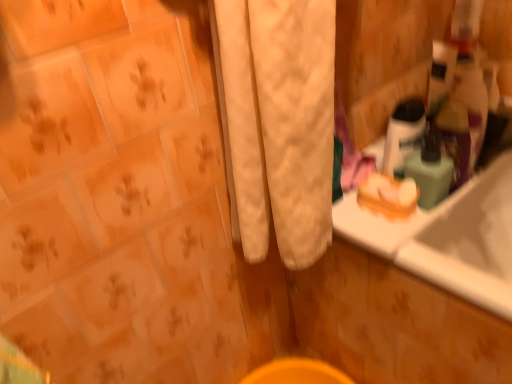
Measure the distance between point (400, 203) and camera.

Point (400, 203) is 79.60 centimeters away from camera.

At what (x,y) coordinates should I click in order to perform the action: click on orange matte soap at right. Please return your answer as a coordinate pair (x, y). Looking at the image, I should click on (388, 195).

The image size is (512, 384). What do you see at coordinates (430, 171) in the screenshot?
I see `green matte bottle at upper right, marked as the first mouthwash in a right-to-left arrangement` at bounding box center [430, 171].

Find the location of a particular element. The width and height of the screenshot is (512, 384). orange matte soap at right is located at coordinates (388, 195).

Is orange matte soap at right at the left side of translucent plastic mouthwash at upper right, arranged as the second mouthwash when viewed from the right?

Correct, you'll find orange matte soap at right to the left of translucent plastic mouthwash at upper right, arranged as the second mouthwash when viewed from the right.

Looking at this image, from the image's perspective, relative to translucent plastic mouthwash at upper right, the 1th mouthwash from the left, is orange matte soap at right above or below?

Clearly, from the image's perspective, orange matte soap at right is below translucent plastic mouthwash at upper right, the 1th mouthwash from the left.

Which of these two, orange matte soap at right or translucent plastic mouthwash at upper right, the 1th mouthwash from the left, is smaller?

With smaller size is orange matte soap at right.

From their relative heights in the image, would you say orange matte soap at right is taller or shorter than translucent plastic mouthwash at upper right, the 1th mouthwash from the left?

In the image, orange matte soap at right appears to be shorter than translucent plastic mouthwash at upper right, the 1th mouthwash from the left.

Relative to orange matte soap at right, is translucent plastic mouthwash at upper right, arranged as the second mouthwash when viewed from the right, in front or behind?

translucent plastic mouthwash at upper right, arranged as the second mouthwash when viewed from the right, is in front of orange matte soap at right.

Based on the photo, who is shorter, translucent plastic mouthwash at upper right, arranged as the second mouthwash when viewed from the right, or orange matte soap at right?

Standing shorter between the two is orange matte soap at right.

From the image's perspective, does translucent plastic mouthwash at upper right, arranged as the second mouthwash when viewed from the right, appear higher than orange matte soap at right?

Yes, from the image's perspective, translucent plastic mouthwash at upper right, arranged as the second mouthwash when viewed from the right, is above orange matte soap at right.

Between point (385, 153) and point (408, 214), which one is positioned behind?

The point (385, 153) is behind.

Which object is positioned more to the left, green matte bottle at upper right, the 2th mouthwash in the left-to-right sequence, or orange matte soap at right?

From the viewer's perspective, orange matte soap at right appears more on the left side.

Between green matte bottle at upper right, the 2th mouthwash in the left-to-right sequence, and orange matte soap at right, which one has larger width?

Wider between the two is orange matte soap at right.

Is green matte bottle at upper right, marked as the first mouthwash in a right-to-left arrangement, in contact with orange matte soap at right?

Yes, green matte bottle at upper right, marked as the first mouthwash in a right-to-left arrangement, is next to orange matte soap at right.

This screenshot has width=512, height=384. What are the coordinates of `soap beneath the green matte bottle at upper right, the 2th mouthwash in the left-to-right sequence (from a real-world perspective)` in the screenshot? It's located at (388, 195).

Is orange matte soap at right spatially inside green matte bottle at upper right, marked as the first mouthwash in a right-to-left arrangement, or outside of it?

orange matte soap at right cannot be found inside green matte bottle at upper right, marked as the first mouthwash in a right-to-left arrangement.

Looking at this image, which object is further away from the camera taking this photo, orange matte soap at right or green matte bottle at upper right, marked as the first mouthwash in a right-to-left arrangement?

Positioned behind is orange matte soap at right.

Is orange matte soap at right to the left or to the right of green matte bottle at upper right, marked as the first mouthwash in a right-to-left arrangement, in the image?

orange matte soap at right is to the left of green matte bottle at upper right, marked as the first mouthwash in a right-to-left arrangement.

Between orange matte soap at right and green matte bottle at upper right, marked as the first mouthwash in a right-to-left arrangement, which one has more height?

green matte bottle at upper right, marked as the first mouthwash in a right-to-left arrangement.

Looking at this image, is green matte bottle at upper right, the 2th mouthwash in the left-to-right sequence, touching translucent plastic mouthwash at upper right, the 1th mouthwash from the left?

Yes, green matte bottle at upper right, the 2th mouthwash in the left-to-right sequence, is in contact with translucent plastic mouthwash at upper right, the 1th mouthwash from the left.

Is green matte bottle at upper right, the 2th mouthwash in the left-to-right sequence, situated inside translucent plastic mouthwash at upper right, arranged as the second mouthwash when viewed from the right, or outside?

green matte bottle at upper right, the 2th mouthwash in the left-to-right sequence, is spatially situated outside translucent plastic mouthwash at upper right, arranged as the second mouthwash when viewed from the right.

Which point is more distant from viewer, [405,162] or [395,144]?

The point [405,162] is farther.

Considering the sizes of objects green matte bottle at upper right, the 2th mouthwash in the left-to-right sequence, and translucent plastic mouthwash at upper right, arranged as the second mouthwash when viewed from the right, in the image provided, who is thinner, green matte bottle at upper right, the 2th mouthwash in the left-to-right sequence, or translucent plastic mouthwash at upper right, arranged as the second mouthwash when viewed from the right,?

With smaller width is translucent plastic mouthwash at upper right, arranged as the second mouthwash when viewed from the right.

Which object is closer to the camera taking this photo, translucent plastic mouthwash at upper right, arranged as the second mouthwash when viewed from the right, or green matte bottle at upper right, marked as the first mouthwash in a right-to-left arrangement?

green matte bottle at upper right, marked as the first mouthwash in a right-to-left arrangement, is in front.

Does translucent plastic mouthwash at upper right, arranged as the second mouthwash when viewed from the right, have a larger size compared to green matte bottle at upper right, marked as the first mouthwash in a right-to-left arrangement?

Correct, translucent plastic mouthwash at upper right, arranged as the second mouthwash when viewed from the right, is larger in size than green matte bottle at upper right, marked as the first mouthwash in a right-to-left arrangement.

Is translucent plastic mouthwash at upper right, the 1th mouthwash from the left, taller or shorter than green matte bottle at upper right, marked as the first mouthwash in a right-to-left arrangement?

Clearly, translucent plastic mouthwash at upper right, the 1th mouthwash from the left, is taller compared to green matte bottle at upper right, marked as the first mouthwash in a right-to-left arrangement.

This screenshot has height=384, width=512. Find the location of `soap located below the translucent plastic mouthwash at upper right, arranged as the second mouthwash when viewed from the right (from the image's perspective)`. soap located below the translucent plastic mouthwash at upper right, arranged as the second mouthwash when viewed from the right (from the image's perspective) is located at coordinates (388, 195).

This screenshot has height=384, width=512. I want to click on the 1st mouthwash in front when counting from the orange matte soap at right, so click(403, 135).

From the image, which object appears to be nearer to green matte bottle at upper right, marked as the first mouthwash in a right-to-left arrangement, translucent plastic mouthwash at upper right, arranged as the second mouthwash when viewed from the right, or orange matte soap at right?

Among the two, translucent plastic mouthwash at upper right, arranged as the second mouthwash when viewed from the right, is located nearer to green matte bottle at upper right, marked as the first mouthwash in a right-to-left arrangement.

Estimate the real-world distances between objects in this image. Which object is closer to translucent plastic mouthwash at upper right, the 1th mouthwash from the left, green matte bottle at upper right, the 2th mouthwash in the left-to-right sequence, or orange matte soap at right?

green matte bottle at upper right, the 2th mouthwash in the left-to-right sequence.

Estimate the real-world distances between objects in this image. Which object is further from orange matte soap at right, translucent plastic mouthwash at upper right, arranged as the second mouthwash when viewed from the right, or green matte bottle at upper right, marked as the first mouthwash in a right-to-left arrangement?

translucent plastic mouthwash at upper right, arranged as the second mouthwash when viewed from the right, lies further to orange matte soap at right than the other object.

When comparing their distances from orange matte soap at right, does green matte bottle at upper right, marked as the first mouthwash in a right-to-left arrangement, or translucent plastic mouthwash at upper right, the 1th mouthwash from the left, seem closer?

Among the two, green matte bottle at upper right, marked as the first mouthwash in a right-to-left arrangement, is located nearer to orange matte soap at right.

Considering their positions, is orange matte soap at right positioned closer to green matte bottle at upper right, marked as the first mouthwash in a right-to-left arrangement, than translucent plastic mouthwash at upper right, arranged as the second mouthwash when viewed from the right?

The object closer to green matte bottle at upper right, marked as the first mouthwash in a right-to-left arrangement, is translucent plastic mouthwash at upper right, arranged as the second mouthwash when viewed from the right.

In the scene shown: Based on their spatial positions, is orange matte soap at right or green matte bottle at upper right, marked as the first mouthwash in a right-to-left arrangement, closer to translucent plastic mouthwash at upper right, arranged as the second mouthwash when viewed from the right?

Based on the image, green matte bottle at upper right, marked as the first mouthwash in a right-to-left arrangement, appears to be nearer to translucent plastic mouthwash at upper right, arranged as the second mouthwash when viewed from the right.

Identify the location of mouthwash between translucent plastic mouthwash at upper right, arranged as the second mouthwash when viewed from the right, and orange matte soap at right from top to bottom. (430, 171).